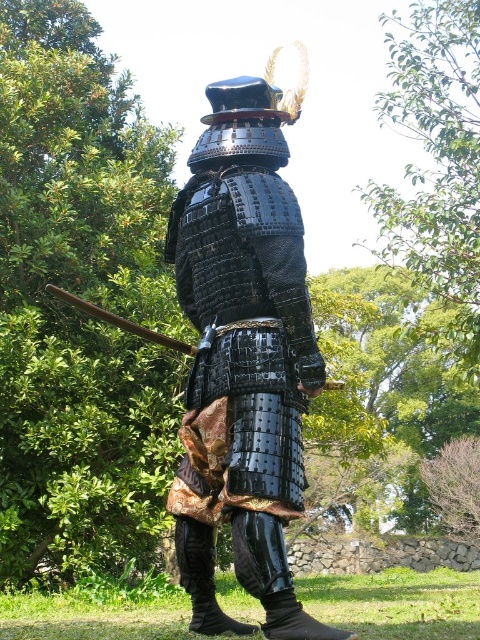
Between glossy black armor at center and brown wooden staff at left, which one appears on the right side from the viewer's perspective?

From the viewer's perspective, glossy black armor at center appears more on the right side.

Can you confirm if glossy black armor at center is bigger than brown wooden staff at left?

Yes, glossy black armor at center is bigger than brown wooden staff at left.

Is point (255, 346) positioned behind point (124, 321)?

No, (255, 346) is in front of (124, 321).

I want to click on glossy black armor at center, so click(243, 356).